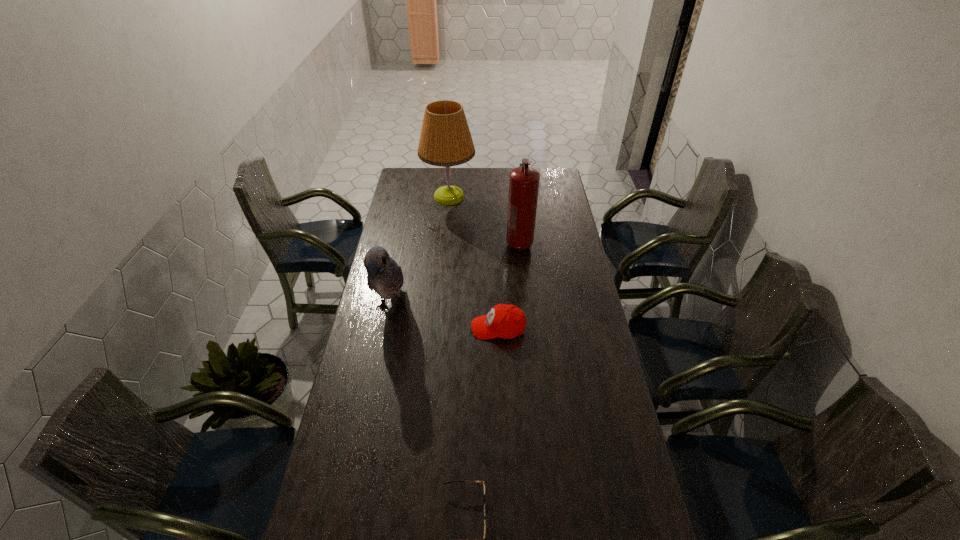
In order to click on lamp in this screenshot , I will do `click(445, 140)`.

Find the location of a particular element. This screenshot has width=960, height=540. fire extinguisher is located at coordinates pos(523,181).

The width and height of the screenshot is (960, 540). Identify the location of parrot. (385, 277).

Locate an element on the screen. baseball cap is located at coordinates coord(505,321).

This screenshot has width=960, height=540. Find the location of `vacant space located on the side of the farthest object near the pull switch`. vacant space located on the side of the farthest object near the pull switch is located at coordinates (494, 197).

I want to click on free space located 0.190m on the handle side the fire extinguisher, so click(523, 286).

The width and height of the screenshot is (960, 540). Find the location of `free region located on the front-facing side of the parrot`. free region located on the front-facing side of the parrot is located at coordinates (372, 407).

I want to click on vacant space located 0.300m on the front panel of the baseball cap, so click(394, 328).

In order to click on free region located on the front panel of the baseball cap in this screenshot , I will do coord(435,328).

Locate an element on the screen. The image size is (960, 540). free space located on the front panel of the baseball cap is located at coordinates click(x=443, y=328).